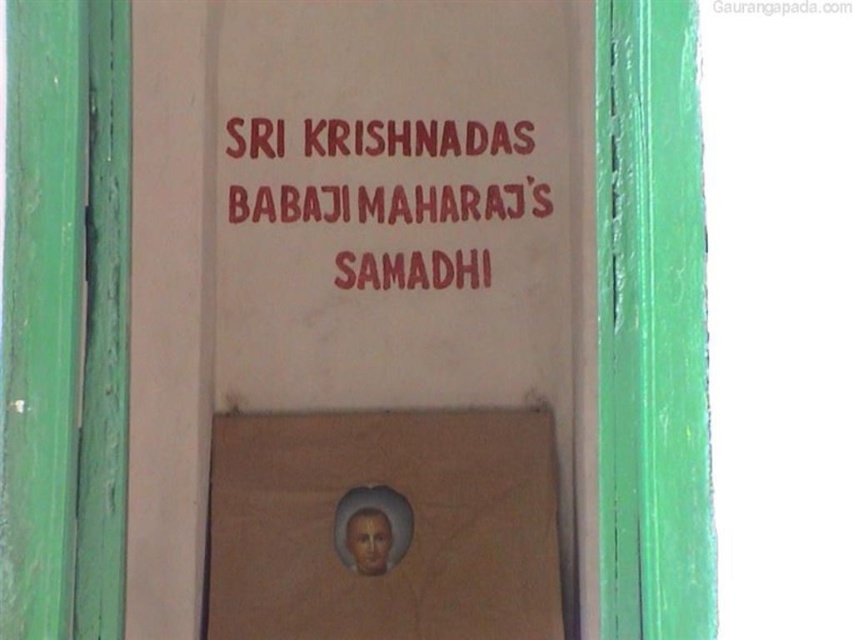
You are standing in front of a wall with a white matte signboard at center and a red painted text at upper center. Which object is located to the left of the other?

Result: The white matte signboard at center is positioned on the left side of red painted text at upper center.

You are standing in front of a wall with a white matte signboard at center and a brown cardboard at center. Which object is covering the other one?

The white matte signboard at center is positioned over the brown cardboard at center, so it is covering it.